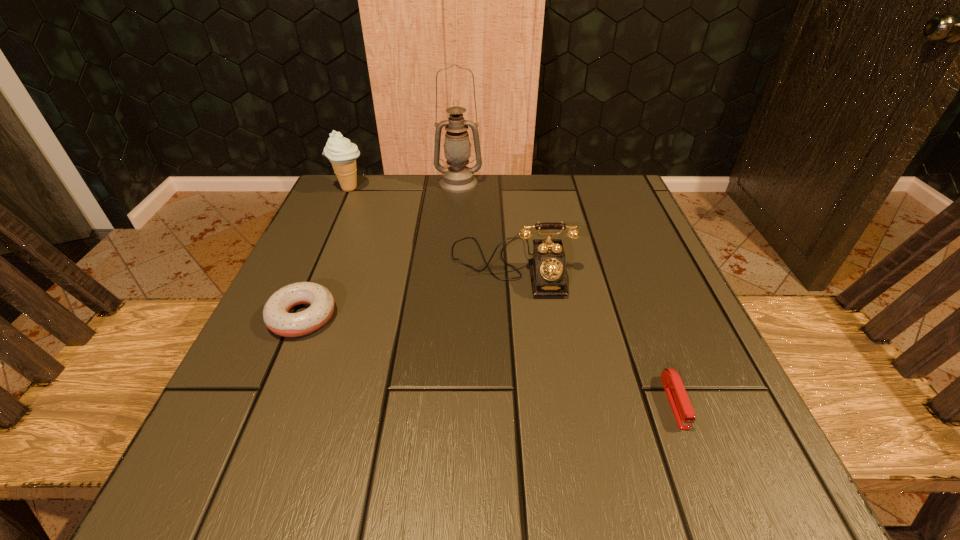
Locate an element on the screen. The image size is (960, 540). free space at the right edge is located at coordinates (637, 358).

In the image, there is a desktop. Find the location of `vacant space at the far right corner`. vacant space at the far right corner is located at coordinates (577, 180).

Find the location of a particular element. vacant area at the near right corner of the desktop is located at coordinates (746, 444).

Find the location of a particular element. The image size is (960, 540). free spot between the fourth tallest object and the fourth shortest object is located at coordinates (325, 253).

Find the location of `free space between the fourth tallest object and the tallest object`. free space between the fourth tallest object and the tallest object is located at coordinates pyautogui.click(x=380, y=250).

You are a GUI agent. You are given a task and a screenshot of the screen. Output one action in this format:
    pyautogui.click(x=<x>, y=<y>)
    Task: Click on the vacant area that lies between the stapler and the second tallest object
    
    Given the screenshot: What is the action you would take?
    pyautogui.click(x=512, y=295)

The image size is (960, 540). Identify the location of free area in between the telephone and the fourth tallest object. (407, 291).

You are a GUI agent. You are given a task and a screenshot of the screen. Output one action in this format:
    pyautogui.click(x=<x>, y=<y>)
    Task: Click on the unoccupied area between the second tallest object and the doughnut
    
    Given the screenshot: What is the action you would take?
    pyautogui.click(x=325, y=253)

Locate an element on the screen. The height and width of the screenshot is (540, 960). unoccupied area between the second shortest object and the shortest object is located at coordinates (489, 359).

Image resolution: width=960 pixels, height=540 pixels. I want to click on free area in between the doughnut and the fourth shortest object, so point(325,253).